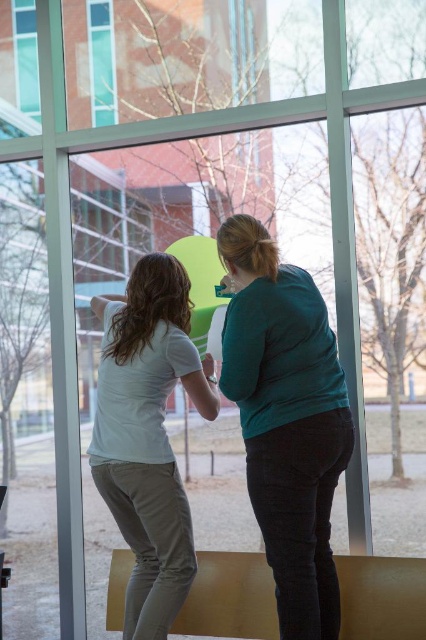
You are a visitor in the room and want to know which object takes up more space in the image. Which one is bigger between the teal matte shirt at center and the transparent glass table at lower center?

The teal matte shirt at center is larger in size than the transparent glass table at lower center, so the teal matte shirt at center takes up more space in the image.

You are a delivery person trying to fit a package that is 10 cm thick through a narrow gap between two objects in the scene. The objects are the teal matte shirt at center and the transparent glass table at lower center. Which object should you place the package next to so it can fit through the gap?

The teal matte shirt at center is thinner than the transparent glass table at lower center, so the package should be placed next to the teal matte shirt at center to fit through the gap.

You are standing in the room and see two points marked on the window. The first point is at position point (144,385) and the second point is at point (425,596). Which point is closer to the bottom edge of the window?

Point (144,385) is closer to the bottom edge of the window because it has a lower y coordinate than point (425,596).